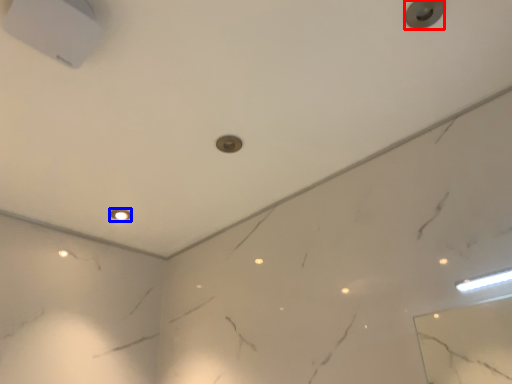
Question: Among these objects, which one is farthest to the camera, knob (highlighted by a red box) or dot (highlighted by a blue box)?

Choices:
 (A) knob
 (B) dot

Answer: (B)